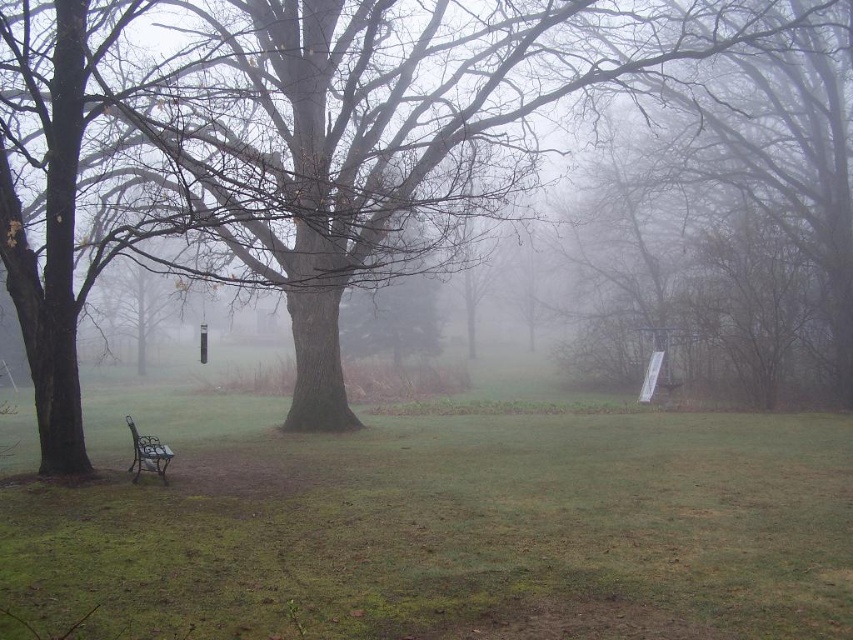
Question: Is brown matte tree at center positioned in front of metallic brown bench at lower left?

Choices:
 (A) yes
 (B) no

Answer: (A)

Question: Can you confirm if brown matte tree at center is positioned above metallic brown bench at lower left?

Choices:
 (A) yes
 (B) no

Answer: (A)

Question: Which of the following is the closest to the observer?

Choices:
 (A) green grass at lower center
 (B) metallic brown bench at lower left
 (C) brown matte tree at center

Answer: (A)

Question: Does green grass at lower center appear on the left side of brown matte tree at center?

Choices:
 (A) yes
 (B) no

Answer: (B)

Question: Considering the real-world distances, which object is farthest from the green grass at lower center?

Choices:
 (A) brown matte tree at center
 (B) metallic brown bench at lower left

Answer: (A)

Question: Which point is farther to the camera?

Choices:
 (A) (138, 468)
 (B) (712, 51)
 (C) (654, 435)

Answer: (C)